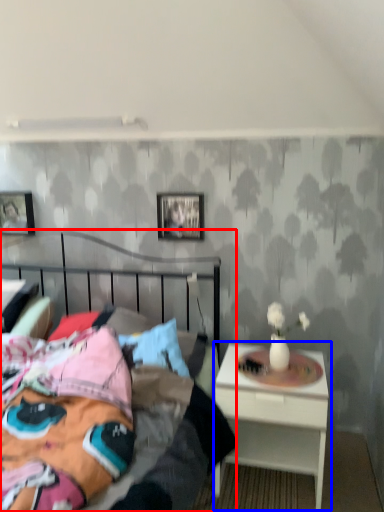
Question: Which object is further to the camera taking this photo, bed (highlighted by a red box) or nightstand (highlighted by a blue box)?

Choices:
 (A) bed
 (B) nightstand

Answer: (B)